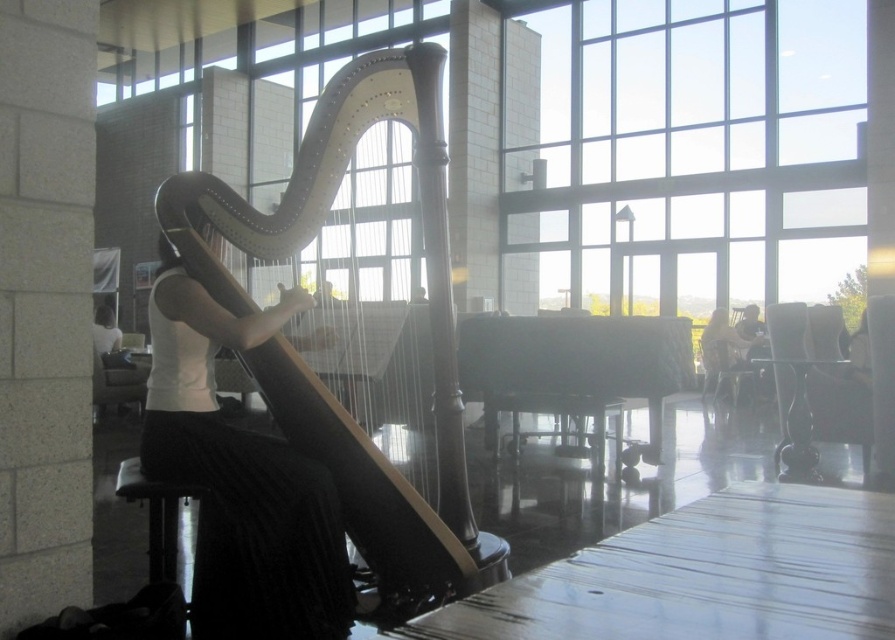
You are a photographer setting up a shoot in the room. You need to place a light source to the right of the polished dark wood harp at center and to the left of the matte white dress at center. Is this possible based on their positions?

The polished dark wood harp at center is positioned on the left side of the matte white dress at center. Therefore, placing a light source to the right of the polished dark wood harp at center and to the left of the matte white dress at center is possible since there is space between them.

You are standing in the room where the harp is being played. You want to look out the transparent glass window at upper center. Which direction should you turn your head to face the window?

The transparent glass window at upper center is located at point 0.237 on the x axis and 0.778 on the y axis. Since the musician is seated off to the left side of the frame, turning your head to the right would align your gaze with the window at upper center.